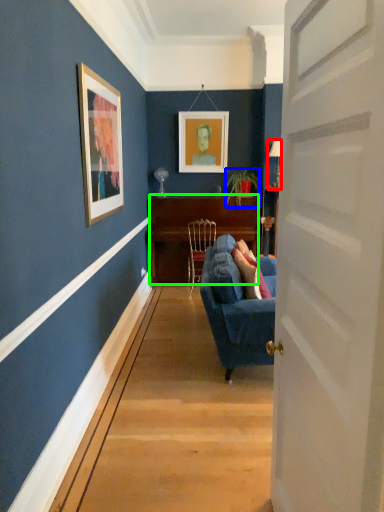
Question: Considering the real-world distances, which object is closest to lamp (highlighted by a red box)? houseplant (highlighted by a blue box) or desk (highlighted by a green box).

Choices:
 (A) houseplant
 (B) desk

Answer: (A)